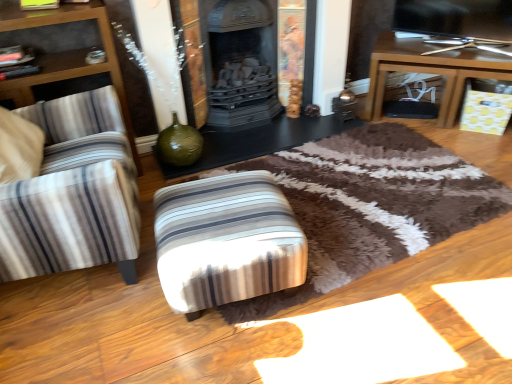
The width and height of the screenshot is (512, 384). What do you see at coordinates (258, 142) in the screenshot?
I see `black glossy table at center, which ranks as the first table in left-to-right order` at bounding box center [258, 142].

Locate an element on the screen. striped fabric stool at center is located at coordinates (226, 241).

The width and height of the screenshot is (512, 384). I want to click on striped fabric ottoman at left, so click(x=73, y=193).

From the image's perspective, which is below, striped fabric ottoman at left or brown wooden table at right, positioned as the second table in left-to-right order?

striped fabric ottoman at left appears lower in the image.

Is striped fabric ottoman at left wider than brown wooden table at right, acting as the 1th table starting from the right?

Yes.

Considering the relative sizes of striped fabric stool at center and brown wooden table at right, acting as the 1th table starting from the right, in the image provided, is striped fabric stool at center thinner than brown wooden table at right, acting as the 1th table starting from the right,?

No.

From a real-world perspective, is striped fabric stool at center beneath brown wooden table at right, positioned as the second table in left-to-right order?

Yes.

Considering the sizes of objects striped fabric stool at center and brown wooden table at right, positioned as the second table in left-to-right order, in the image provided, who is smaller, striped fabric stool at center or brown wooden table at right, positioned as the second table in left-to-right order,?

striped fabric stool at center is smaller.

Could you measure the distance between striped fabric stool at center and brown wooden table at right, positioned as the second table in left-to-right order?

striped fabric stool at center is 1.56 meters from brown wooden table at right, positioned as the second table in left-to-right order.

At what (x,y) coordinates should I click in order to perform the action: click on table on the right of the black glossy table at center, which is the 2th table from right to left. Please return your answer as a coordinate pair (x, y). Looking at the image, I should click on (430, 71).

Is the position of black glossy table at center, which ranks as the first table in left-to-right order, more distant than that of brown wooden table at right, acting as the 1th table starting from the right?

No, the depth of black glossy table at center, which ranks as the first table in left-to-right order, is less than that of brown wooden table at right, acting as the 1th table starting from the right.

Who is bigger, black glossy table at center, which ranks as the first table in left-to-right order, or brown wooden table at right, acting as the 1th table starting from the right?

Bigger between the two is brown wooden table at right, acting as the 1th table starting from the right.

Is black glossy table at center, which is the 2th table from right to left, taller or shorter than brown wooden table at right, acting as the 1th table starting from the right?

Considering their sizes, black glossy table at center, which is the 2th table from right to left, has less height than brown wooden table at right, acting as the 1th table starting from the right.

Is brown wooden table at right, acting as the 1th table starting from the right, thinner than striped fabric stool at center?

Yes, brown wooden table at right, acting as the 1th table starting from the right, is thinner than striped fabric stool at center.

Locate an element on the screen. stool in front of the brown wooden table at right, acting as the 1th table starting from the right is located at coordinates (226, 241).

Between brown wooden table at right, positioned as the second table in left-to-right order, and striped fabric stool at center, which one has less height?

striped fabric stool at center is shorter.

Who is smaller, brown wooden table at right, positioned as the second table in left-to-right order, or striped fabric stool at center?

Smaller between the two is striped fabric stool at center.

Considering the sizes of objects striped fabric ottoman at left and striped fabric stool at center in the image provided, who is shorter, striped fabric ottoman at left or striped fabric stool at center?

Standing shorter between the two is striped fabric stool at center.

In terms of width, does striped fabric ottoman at left look wider or thinner when compared to striped fabric stool at center?

Clearly, striped fabric ottoman at left has more width compared to striped fabric stool at center.

Is the position of striped fabric ottoman at left more distant than that of striped fabric stool at center?

No, it is not.

Is striped fabric ottoman at left bigger or smaller than striped fabric stool at center?

Considering their sizes, striped fabric ottoman at left takes up more space than striped fabric stool at center.

From the image's perspective, which one is positioned higher, brown wooden table at right, positioned as the second table in left-to-right order, or striped fabric ottoman at left?

From the image's view, brown wooden table at right, positioned as the second table in left-to-right order, is above.

Which is less distant, (375, 106) or (5, 207)?

The point (5, 207) is closer.

Is brown wooden table at right, acting as the 1th table starting from the right, oriented towards striped fabric ottoman at left?

No, brown wooden table at right, acting as the 1th table starting from the right, is not aimed at striped fabric ottoman at left.

Which object is thinner, brown wooden table at right, acting as the 1th table starting from the right, or striped fabric ottoman at left?

brown wooden table at right, acting as the 1th table starting from the right, is thinner.

From a real-world perspective, is black glossy table at center, which is the 2th table from right to left, below striped fabric ottoman at left?

Yes.

From the image's perspective, is black glossy table at center, which is the 2th table from right to left, below striped fabric ottoman at left?

No.

Is striped fabric ottoman at left at the back of black glossy table at center, which is the 2th table from right to left?

No, black glossy table at center, which is the 2th table from right to left, is not facing away from striped fabric ottoman at left.

Is black glossy table at center, which ranks as the first table in left-to-right order, in front of or behind striped fabric ottoman at left in the image?

black glossy table at center, which ranks as the first table in left-to-right order, is behind striped fabric ottoman at left.

There is a striped fabric ottoman at left. Identify the location of the 1st table below it (from a real-world perspective). (430, 71).

Where is `stool that appears below the brown wooden table at right, acting as the 1th table starting from the right (from the image's perspective)`? The image size is (512, 384). stool that appears below the brown wooden table at right, acting as the 1th table starting from the right (from the image's perspective) is located at coordinates (226, 241).

Which object lies further to the anchor point striped fabric stool at center, striped fabric ottoman at left or brown wooden table at right, positioned as the second table in left-to-right order?

Based on the image, brown wooden table at right, positioned as the second table in left-to-right order, appears to be further to striped fabric stool at center.

Which object lies further to the anchor point brown wooden table at right, positioned as the second table in left-to-right order, striped fabric ottoman at left or black glossy table at center, which ranks as the first table in left-to-right order?

striped fabric ottoman at left.

From the image, which object appears to be nearer to striped fabric ottoman at left, striped fabric stool at center or brown wooden table at right, acting as the 1th table starting from the right?

striped fabric stool at center.

Estimate the real-world distances between objects in this image. Which object is further from brown wooden table at right, positioned as the second table in left-to-right order, striped fabric ottoman at left or striped fabric stool at center?

Among the two, striped fabric ottoman at left is located further to brown wooden table at right, positioned as the second table in left-to-right order.

Based on the photo, from the image, which object appears to be farther from black glossy table at center, which ranks as the first table in left-to-right order, striped fabric ottoman at left or brown wooden table at right, positioned as the second table in left-to-right order?

Among the two, striped fabric ottoman at left is located further to black glossy table at center, which ranks as the first table in left-to-right order.

Estimate the real-world distances between objects in this image. Which object is closer to striped fabric ottoman at left, black glossy table at center, which is the 2th table from right to left, or brown wooden table at right, acting as the 1th table starting from the right?

black glossy table at center, which is the 2th table from right to left, lies closer to striped fabric ottoman at left than the other object.

Which object lies nearer to the anchor point black glossy table at center, which ranks as the first table in left-to-right order, brown wooden table at right, positioned as the second table in left-to-right order, or striped fabric stool at center?

Among the two, brown wooden table at right, positioned as the second table in left-to-right order, is located nearer to black glossy table at center, which ranks as the first table in left-to-right order.

Looking at the image, which one is located closer to striped fabric stool at center, black glossy table at center, which ranks as the first table in left-to-right order, or brown wooden table at right, acting as the 1th table starting from the right?

black glossy table at center, which ranks as the first table in left-to-right order, is closer to striped fabric stool at center.

Identify the location of stool between striped fabric ottoman at left and brown wooden table at right, positioned as the second table in left-to-right order, from left to right. Image resolution: width=512 pixels, height=384 pixels. (226, 241).

Locate an element on the screen. This screenshot has height=384, width=512. table between striped fabric stool at center and brown wooden table at right, acting as the 1th table starting from the right, in the horizontal direction is located at coordinates (258, 142).

Identify the location of table between striped fabric ottoman at left and brown wooden table at right, positioned as the second table in left-to-right order, in the horizontal direction. The height and width of the screenshot is (384, 512). (258, 142).

Locate an element on the screen. This screenshot has width=512, height=384. stool between striped fabric ottoman at left and black glossy table at center, which ranks as the first table in left-to-right order, in the front-back direction is located at coordinates click(226, 241).